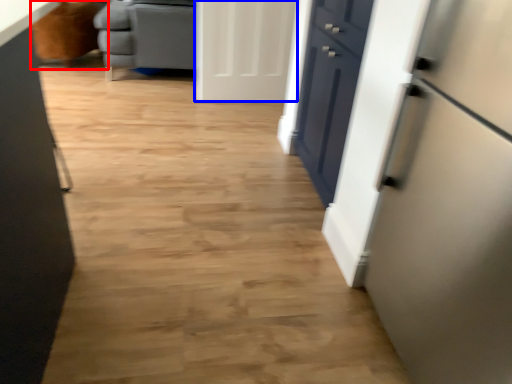
Question: Which object appears farthest to the camera in this image, armchair (highlighted by a red box) or door (highlighted by a blue box)?

Choices:
 (A) armchair
 (B) door

Answer: (A)